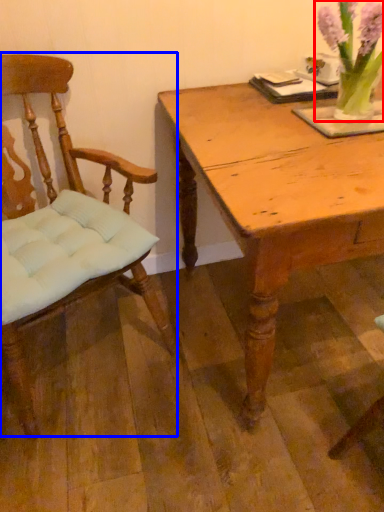
Question: Among these objects, which one is farthest to the camera, floral arrangement (highlighted by a red box) or chair (highlighted by a blue box)?

Choices:
 (A) floral arrangement
 (B) chair

Answer: (A)